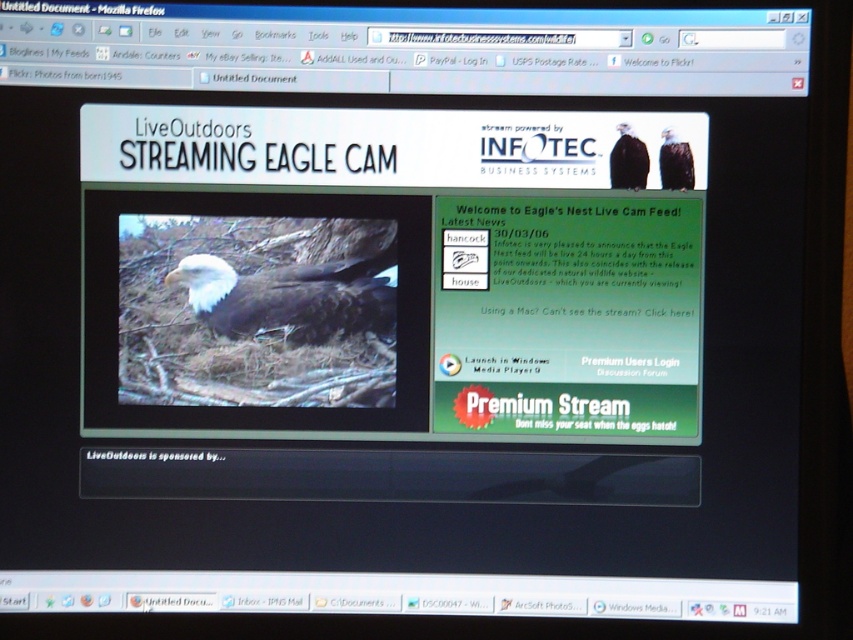
You are a user trying to click on the login button located at point (616,160). However, there is an overlay at point (193,289) that might be blocking it. Based on the spatial relationship between these two points, will you be able to successfully click the login button?

Point (193,289) is behind point (616,160), so the overlay at point (193,289) does not block the login button at point (616,160). You can successfully click the login button.

Based on the photo, you are a technician who needs to adjust the camera angle to focus on the matte black eagle at upper right. Given that the camera is 1.22 meters away from the eagle, what is the minimum focal length required for the camera lens to capture the eagle clearly?

The camera lens must have a focal length of at least 1.22 meters to focus on the matte black eagle at upper right, as the eagle is 1.22 meters away from the camera.

You are a wildlife researcher observing the eagle cam. You notice the white feathered eagle at center and the dark brown feathers at upper right. Which object is positioned to the right side of the other?

The white feathered eagle at center is to the left of dark brown feathers at upper right, so the dark brown feathers at upper right are positioned to the right side of the white feathered eagle at center.